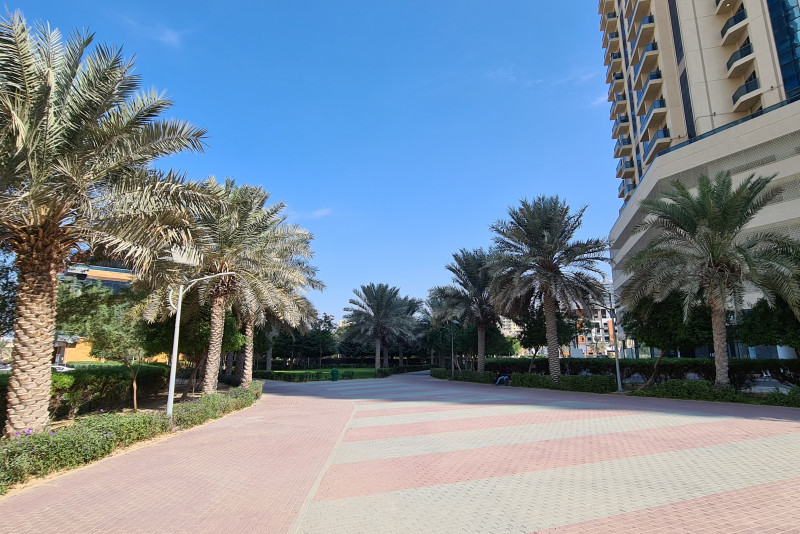
You are a GUI agent. You are given a task and a screenshot of the screen. Output one action in this format:
    pyautogui.click(x=<x>, y=<y>)
    Task: Click on the windows
    
    Given the screenshot: What is the action you would take?
    pyautogui.click(x=774, y=38)